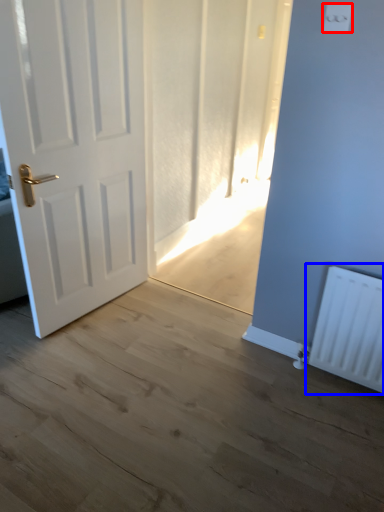
Question: Which object appears closest to the camera in this image, light switch (highlighted by a red box) or radiator (highlighted by a blue box)?

Choices:
 (A) light switch
 (B) radiator

Answer: (A)